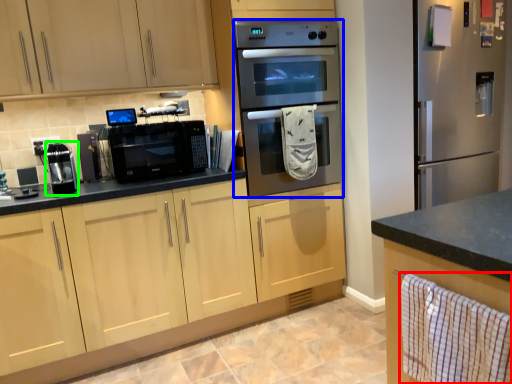
Question: Considering the real-world distances, which object is farthest from hand towel (highlighted by a red box)? microwave oven (highlighted by a blue box) or appliance (highlighted by a green box)?

Choices:
 (A) microwave oven
 (B) appliance

Answer: (B)